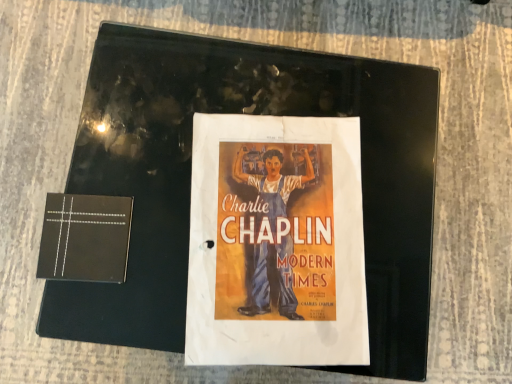
Question: Is black matte paper at left bigger or smaller than matte paper poster at center?

Choices:
 (A) small
 (B) big

Answer: (A)

Question: Is point (103, 261) closer or farther from the camera than point (190, 56)?

Choices:
 (A) closer
 (B) farther

Answer: (A)

Question: From the image's perspective, is black matte paper at left positioned above or below matte paper poster at center?

Choices:
 (A) below
 (B) above

Answer: (A)

Question: Does point (395, 210) appear closer or farther from the camera than point (92, 279)?

Choices:
 (A) farther
 (B) closer

Answer: (A)

Question: Is matte paper poster at center spatially inside black matte paper at left, or outside of it?

Choices:
 (A) outside
 (B) inside

Answer: (A)

Question: From the image's perspective, relative to black matte paper at left, is matte paper poster at center above or below?

Choices:
 (A) above
 (B) below

Answer: (A)

Question: From a real-world perspective, is matte paper poster at center physically located above or below black matte paper at left?

Choices:
 (A) below
 (B) above

Answer: (A)